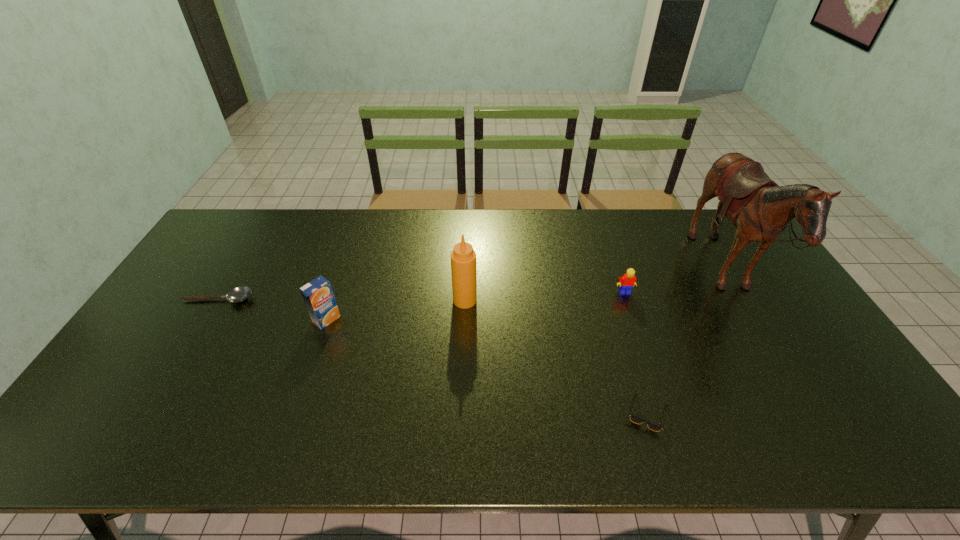
The height and width of the screenshot is (540, 960). What are the coordinates of `free region that satisfies the following two spatial constraints: 1. on the back of the tallest object; 2. on the front side of the condiment` in the screenshot? It's located at (740, 300).